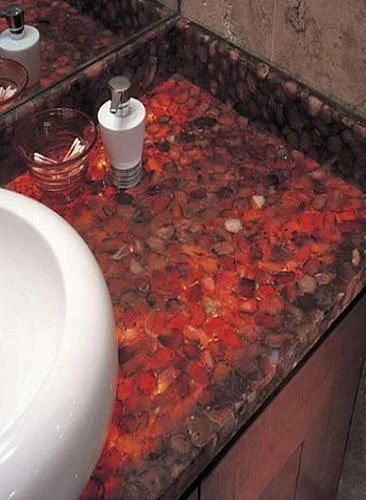
Locate an element on the screen. The height and width of the screenshot is (500, 366). counter is located at coordinates (225, 272).